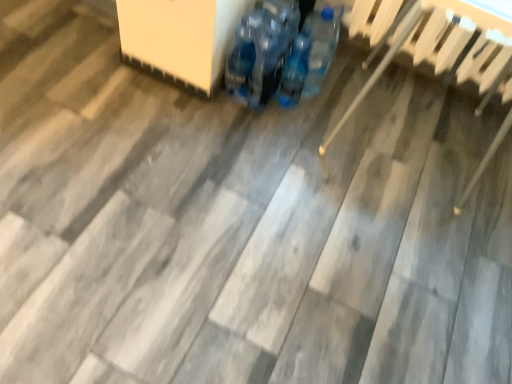
This screenshot has height=384, width=512. Identify the location of free region on the left part of blue plastic bottles at center. (250, 107).